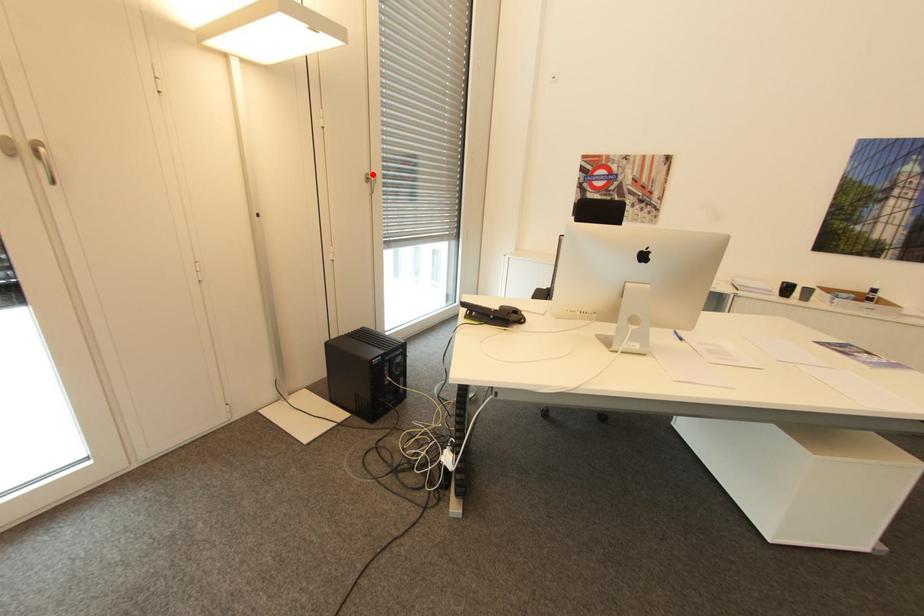
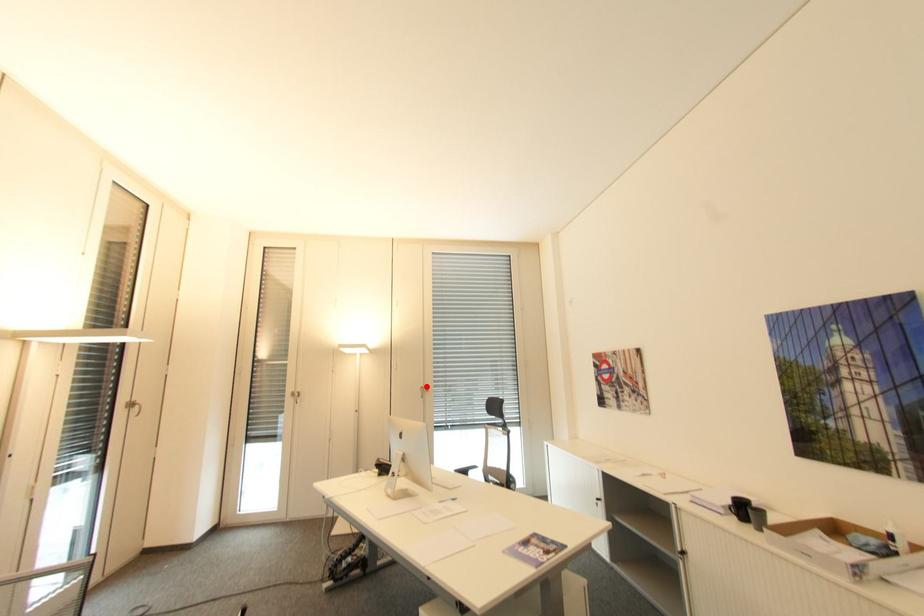
I am providing you with two images of the same scene from different viewpoints. A red point is marked on the first image and another point is marked on the second image. Do the highlighted points in image1 and image2 indicate the same real-world spot?

Yes